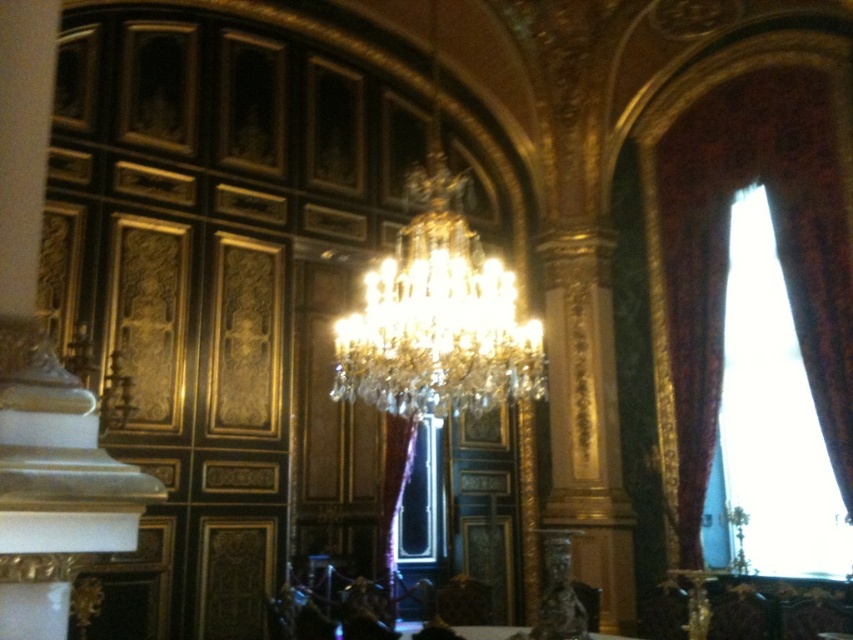
Question: Which of the following is the closest to the observer?

Choices:
 (A) (534, 362)
 (B) (813, 188)
 (C) (392, 424)

Answer: (A)

Question: Does velvet drapery at right lie behind satin gold curtain at center?

Choices:
 (A) yes
 (B) no

Answer: (B)

Question: Is clear crystal chandelier at center further to camera compared to satin gold curtain at center?

Choices:
 (A) yes
 (B) no

Answer: (B)

Question: Is clear crystal chandelier at center smaller than satin gold curtain at center?

Choices:
 (A) no
 (B) yes

Answer: (A)

Question: Among these objects, which one is nearest to the camera?

Choices:
 (A) satin gold curtain at center
 (B) white glossy table at lower center

Answer: (B)

Question: Which point is closer to the camera taking this photo?

Choices:
 (A) (677, 392)
 (B) (450, 403)
 (C) (399, 477)
 (D) (527, 627)

Answer: (B)